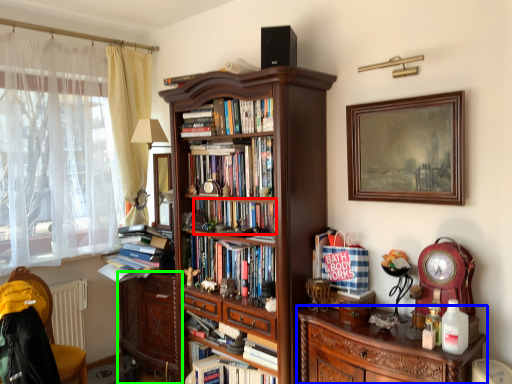
Question: Considering the real-world distances, which object is closest to book (highlighted by a red box)? cabinetry (highlighted by a blue box) or chest of drawers (highlighted by a green box).

Choices:
 (A) cabinetry
 (B) chest of drawers

Answer: (A)